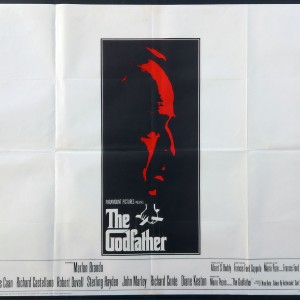
Find the location of a particular element. fold in poster is located at coordinates (27, 149), (54, 239), (52, 82), (55, 14), (152, 258), (248, 226), (224, 149), (282, 149), (246, 69), (147, 151).